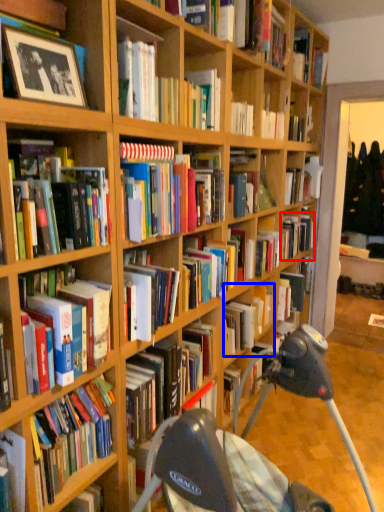
Question: Which point is closer to the camera, book (highlighted by a red box) or book (highlighted by a blue box)?

Choices:
 (A) book
 (B) book

Answer: (B)